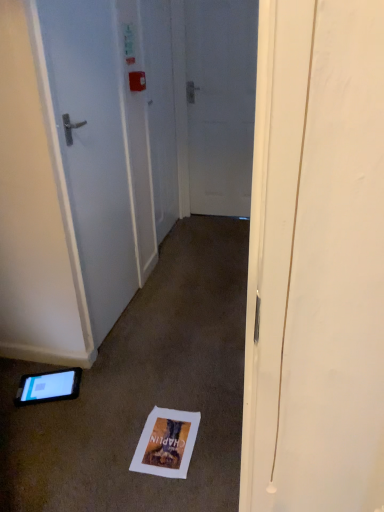
Where is `unoccupied area in front of white paper postcard at lower center`? unoccupied area in front of white paper postcard at lower center is located at coordinates (163, 494).